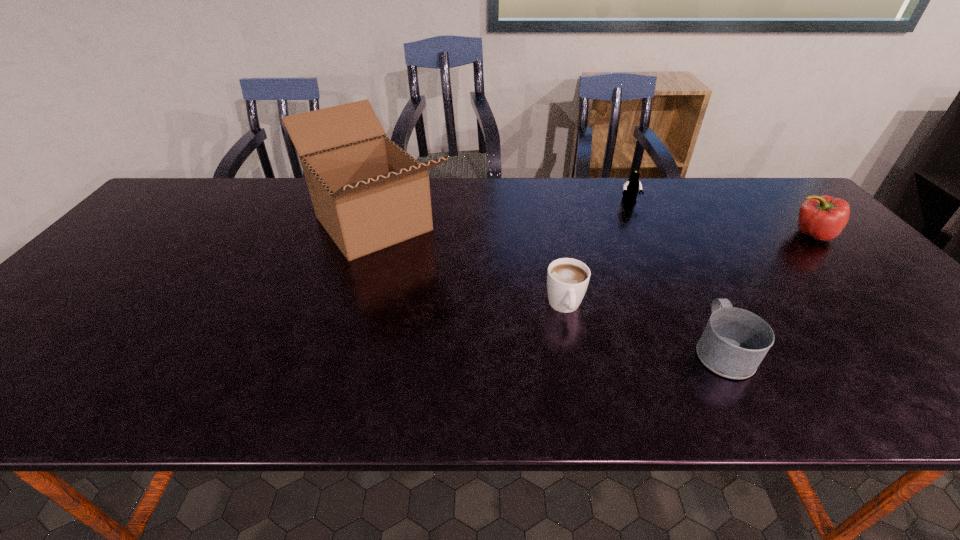
The image size is (960, 540). Find the location of `vacant space located 0.050m on the side of the mug with the handle`. vacant space located 0.050m on the side of the mug with the handle is located at coordinates (699, 307).

Identify the location of free location located 0.100m on the side of the mug with the handle. (691, 293).

The image size is (960, 540). I want to click on vacant point located 0.270m on the side of the mug with the handle, so click(x=669, y=250).

At what (x,y) coordinates should I click in order to perform the action: click on box at the far edge. Please return your answer as a coordinate pair (x, y). This screenshot has width=960, height=540. Looking at the image, I should click on pyautogui.click(x=368, y=193).

Find the location of a particular element. The image size is (960, 540). Lego located in the far edge section of the desktop is located at coordinates (631, 187).

The image size is (960, 540). I want to click on object that is at the near edge, so click(x=734, y=342).

Locate an element on the screen. object positioned at the right edge is located at coordinates (823, 217).

The image size is (960, 540). I want to click on vacant space at the near edge, so click(295, 384).

The image size is (960, 540). I want to click on vacant space at the left edge of the desktop, so click(x=126, y=240).

In the image, there is a desktop. At what (x,y) coordinates should I click in order to perform the action: click on vacant space at the right edge. Please return your answer as a coordinate pair (x, y). This screenshot has height=540, width=960. Looking at the image, I should click on (883, 281).